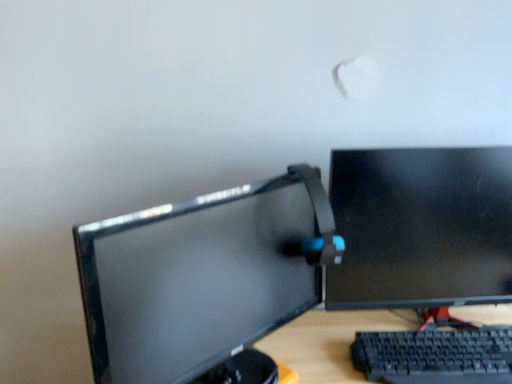
Locate an element on the screen. The image size is (512, 384). blank space situated above black plastic keyboard at lower right (from a real-world perspective) is located at coordinates (450, 345).